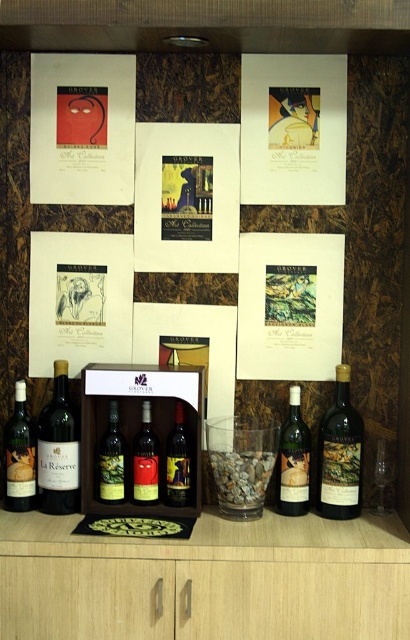
The image size is (410, 640). What do you see at coordinates (59, 449) in the screenshot?
I see `dark red glass bottle at lower left` at bounding box center [59, 449].

Is point (38, 493) closer to viewer compared to point (148, 410)?

Yes, point (38, 493) is in front of point (148, 410).

You are a GUI agent. You are given a task and a screenshot of the screen. Output one action in this format:
    pyautogui.click(x=<x>, y=<y>)
    Task: Click on the dark red glass bottle at lower left
    The height and width of the screenshot is (640, 410).
    Given the screenshot: What is the action you would take?
    pyautogui.click(x=59, y=449)

Looking at this image, is matte red wine at center below transparent glass wine glass at lower right?

Incorrect, matte red wine at center is not positioned below transparent glass wine glass at lower right.

Does point (148, 500) lie in front of point (378, 502)?

Yes, point (148, 500) is in front of point (378, 502).

Find the location of a particular element. The width and height of the screenshot is (410, 640). matte red wine at center is located at coordinates (145, 460).

Is matte glass bottle at center shorter than transparent glass wine glass at lower right?

In fact, matte glass bottle at center may be taller than transparent glass wine glass at lower right.

Can you confirm if matte glass bottle at center is smaller than transparent glass wine glass at lower right?

No, matte glass bottle at center is not smaller than transparent glass wine glass at lower right.

Based on the photo, measure the distance between matte glass bottle at center and camera.

matte glass bottle at center is 5.22 feet away from camera.

Locate an element on the screen. The width and height of the screenshot is (410, 640). matte glass bottle at center is located at coordinates (293, 460).